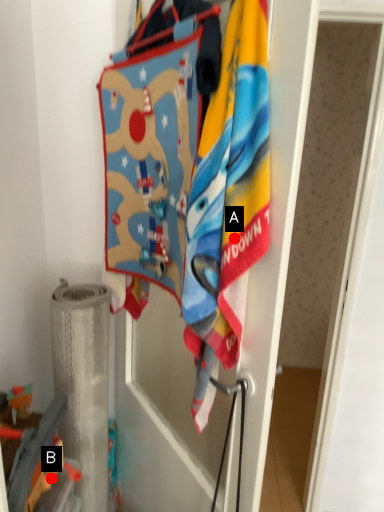
Question: Two points are circled on the image, labeled by A and B beside each circle. Among these points, which one is nearest to the camera?

Choices:
 (A) A is closer
 (B) B is closer

Answer: (A)